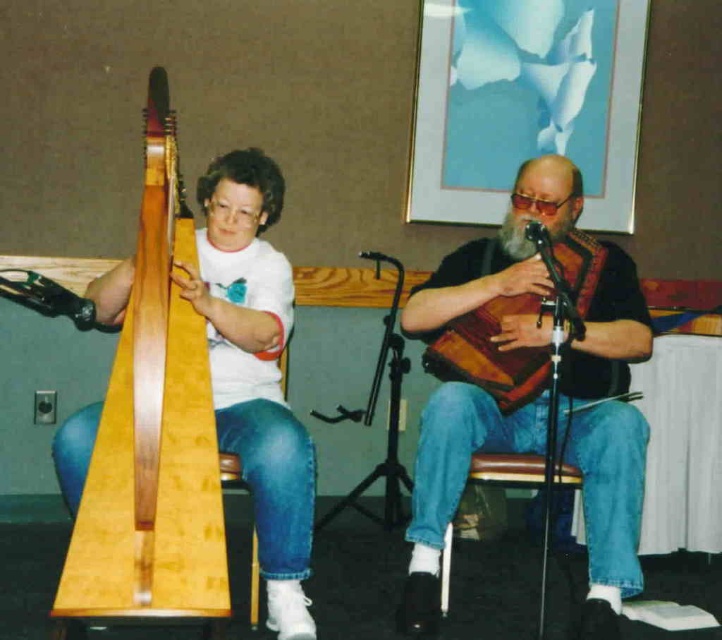
Does point (406, 532) lie in front of point (434, 337)?

That is True.

Measure the distance between brown wooden instrument at center and camera.

A distance of 6.98 feet exists between brown wooden instrument at center and camera.

Who is more forward, (x=627, y=509) or (x=583, y=240)?

Positioned in front is point (x=627, y=509).

Locate an element on the screen. The width and height of the screenshot is (722, 640). brown wooden instrument at center is located at coordinates (608, 436).

Does wooden textured bagpipe at center appear over brown wood stool at lower center?

Yes, wooden textured bagpipe at center is above brown wood stool at lower center.

Between wooden textured bagpipe at center and brown wood stool at lower center, which one appears on the left side from the viewer's perspective?

From the viewer's perspective, brown wood stool at lower center appears more on the left side.

The height and width of the screenshot is (640, 722). Find the location of `wooden textured bagpipe at center`. wooden textured bagpipe at center is located at coordinates (490, 353).

Who is taller, light brown wood harp at left or wooden textured bagpipe at center?

light brown wood harp at left is taller.

Who is more forward, (170, 195) or (562, 275)?

Point (170, 195) is in front.

At what (x,y) coordinates should I click in order to perform the action: click on light brown wood harp at left. Please return your answer as a coordinate pair (x, y). Image resolution: width=722 pixels, height=640 pixels. Looking at the image, I should click on (152, 432).